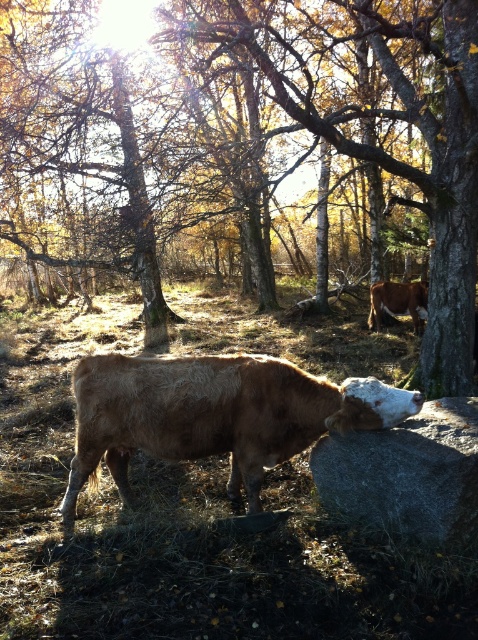
You are a photographer trying to capture a photo of the brown fuzzy bull at center and the brown bark tree at center. If you want both subjects to be in focus, which one should you focus on first?

The brown bark tree at center has a larger size compared to the brown fuzzy bull at center, so you should focus on the brown bark tree at center first to ensure both are in focus.